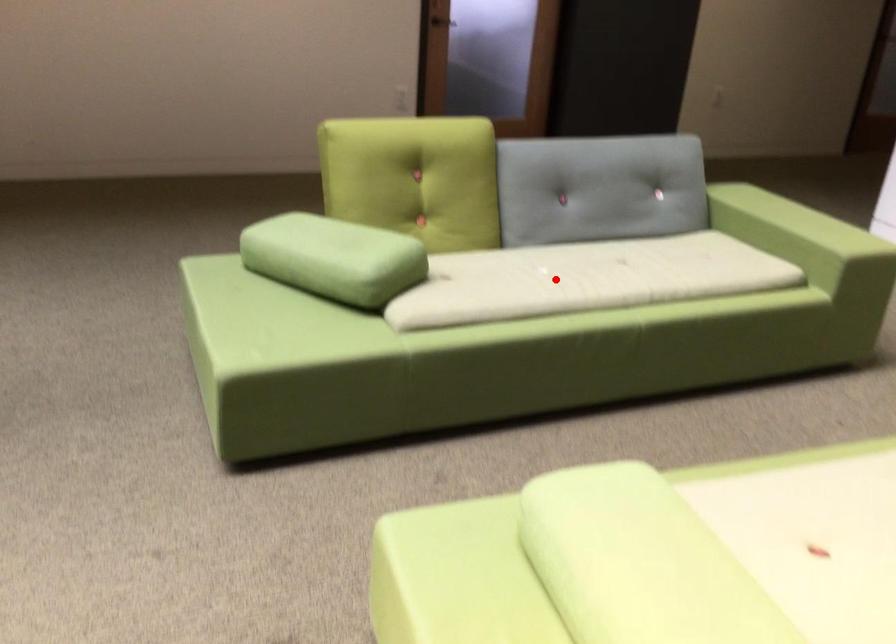
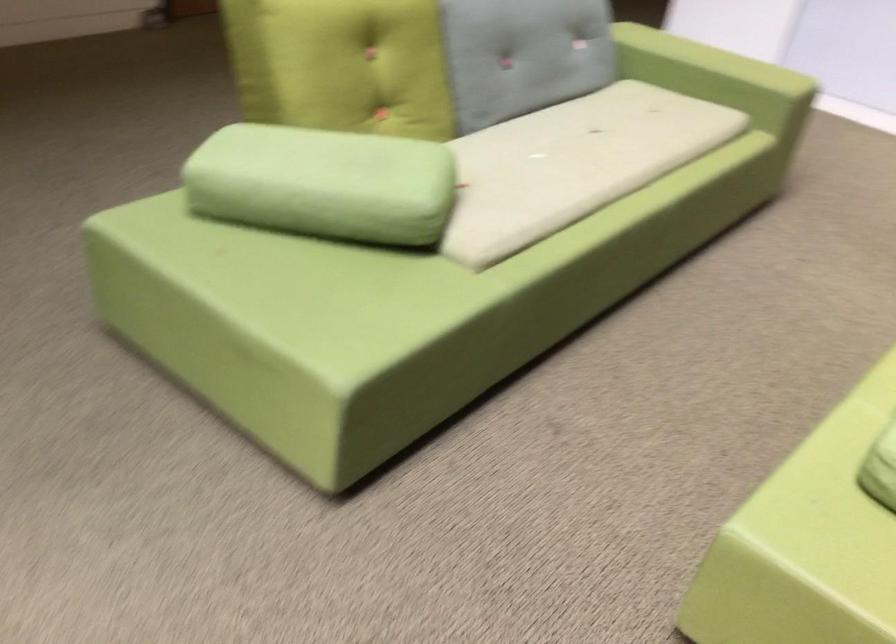
Question: I am providing you with two images of the same scene from different viewpoints. A red point is shown in image1. For the corresponding object point in image2, is it positioned nearer or farther from the camera?

Choices:
 (A) Nearer
 (B) Farther

Answer: (A)